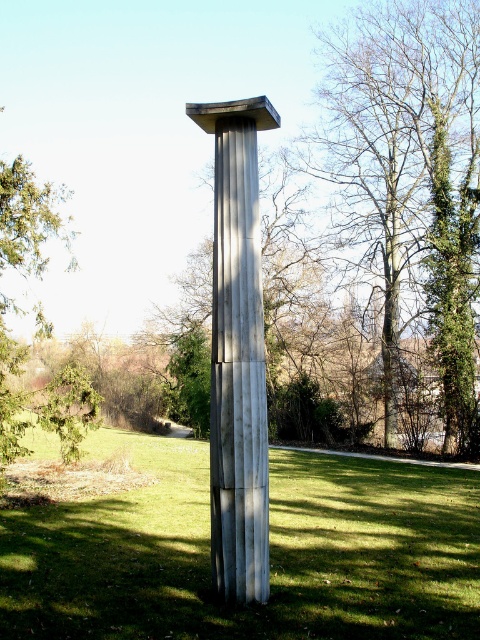
Who is more forward, (264,564) or (2,356)?

Positioned in front is point (264,564).

Which of these two, satin silver column at center or green leafy tree at left, stands shorter?

satin silver column at center

Which is in front, point (219, 506) or point (10, 305)?

Point (219, 506)

Locate an element on the screen. satin silver column at center is located at coordinates (238, 355).

Can you confirm if green leafy tree at center is smaller than green leafy tree at left?

Yes, green leafy tree at center is smaller than green leafy tree at left.

Does green leafy tree at center have a larger size compared to green leafy tree at left?

Incorrect, green leafy tree at center is not larger than green leafy tree at left.

Who is more distant from viewer, (396, 96) or (32, 250)?

The point (396, 96) is more distant.

Where is `green leafy tree at center`? green leafy tree at center is located at coordinates click(x=409, y=180).

Based on the photo, does green grass at center have a greater height compared to satin silver column at center?

Incorrect, green grass at center's height is not larger of satin silver column at center's.

From the picture: Does green grass at center appear under satin silver column at center?

Yes, green grass at center is below satin silver column at center.

Between point (184, 492) and point (244, 548), which one is positioned in front?

Point (244, 548) is in front.

Identify the location of green grass at center. (269, 552).